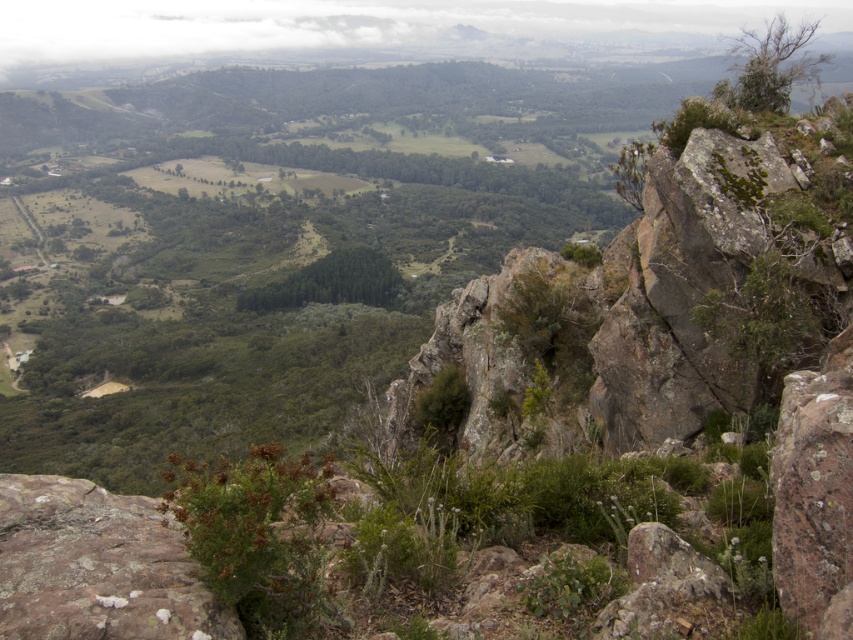
Who is shorter, rusty rock at lower left or green leafy forest at center?

With less height is rusty rock at lower left.

The height and width of the screenshot is (640, 853). Identify the location of rusty rock at lower left. (97, 566).

Is rusty rock at center to the right of green leafy forest at center from the viewer's perspective?

Yes, rusty rock at center is to the right of green leafy forest at center.

Which is more to the right, rusty rock at center or green leafy forest at center?

rusty rock at center is more to the right.

Who is more forward, [686,579] or [320,296]?

Positioned in front is point [686,579].

Identify the location of rusty rock at center. (666, 589).

Which of these two, rusty rock at lower left or rusty rock at center, stands taller?

With more height is rusty rock at lower left.

Which is above, rusty rock at lower left or rusty rock at center?

rusty rock at lower left

Is point (100, 632) behind point (694, 563)?

No.

In order to click on rusty rock at lower left in this screenshot , I will do `click(97, 566)`.